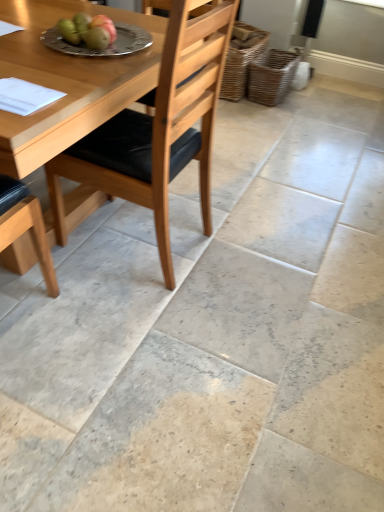
At what (x,y) coordinates should I click in order to perform the action: click on space that is in front of woven brown basket at lower right, arranged as the first basket when viewed from the right. Please return your answer as a coordinate pair (x, y). This screenshot has height=512, width=384. Looking at the image, I should click on (266, 116).